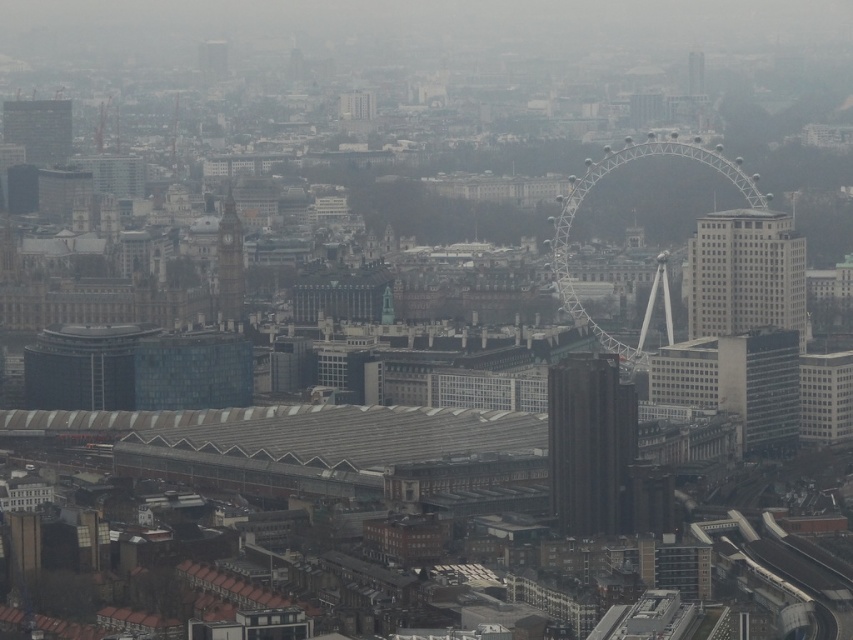
Is matte glass skyscraper at upper left shorter than smooth glass tower at upper right?

No.

Is point (32, 104) positioned in front of point (689, 84)?

No, (32, 104) is further to viewer.

Where is `matte glass skyscraper at upper left`? This screenshot has width=853, height=640. matte glass skyscraper at upper left is located at coordinates (38, 129).

Between smooth black tower at center and dark gray stone clock tower at center-left, which one is positioned higher?

A: Positioned higher is dark gray stone clock tower at center-left.

Is point (618, 467) positioned behind point (230, 300)?

Yes.

Identify the location of smooth black tower at center. (590, 444).

Is the position of smooth black tower at center more distant than that of white glass building at center-right?

No.

Looking at this image, does smooth black tower at center appear on the right side of white glass building at center-right?

In fact, smooth black tower at center is to the left of white glass building at center-right.

Which is in front, point (611, 369) or point (805, 250)?

Point (611, 369)

The height and width of the screenshot is (640, 853). I want to click on smooth black tower at center, so click(x=590, y=444).